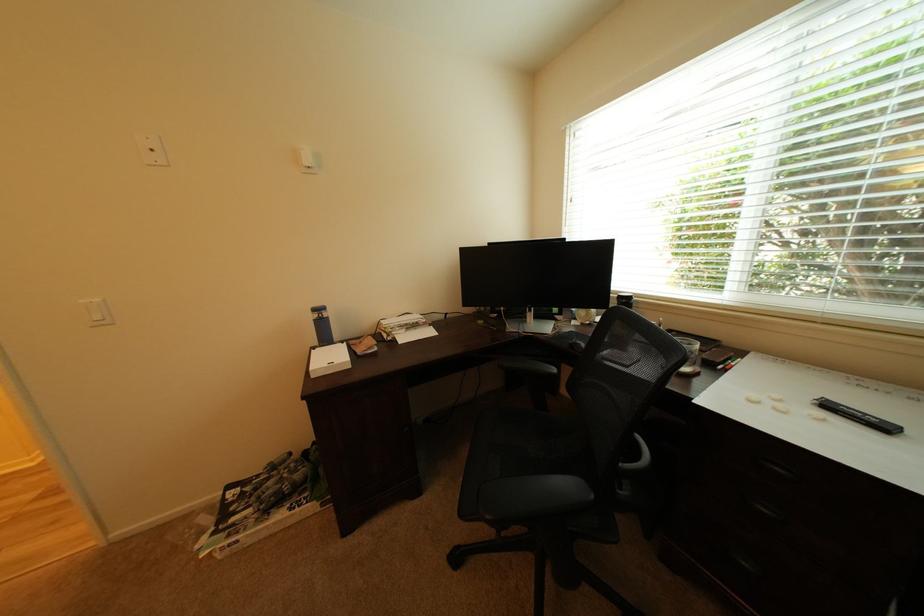
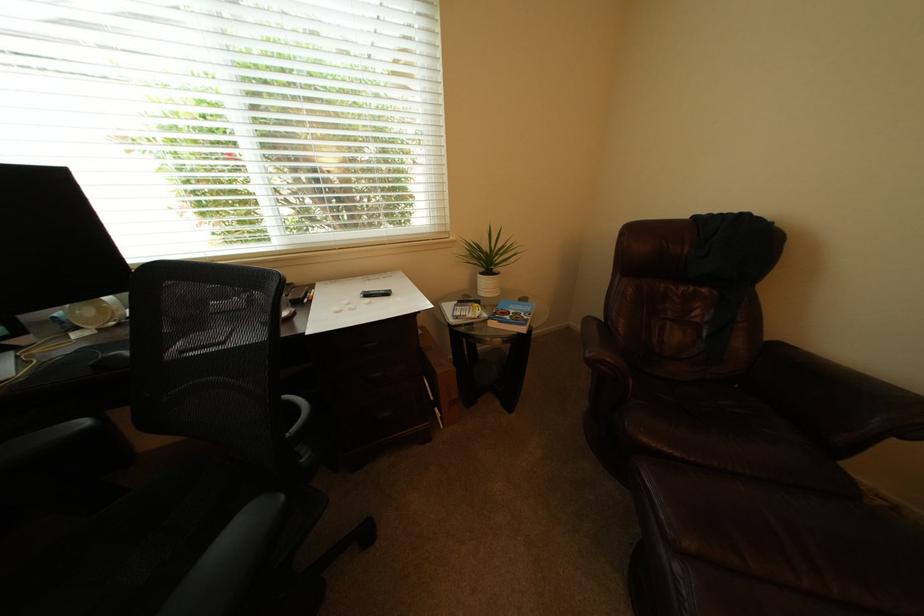
Where in the second image is the point corresponding to [602,310] from the first image?

(116, 300)